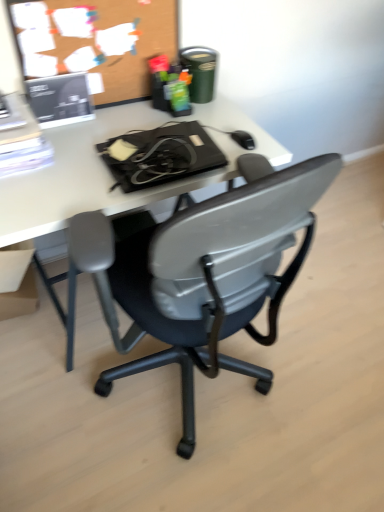
This screenshot has height=512, width=384. What do you see at coordinates (243, 139) in the screenshot?
I see `black plastic mouse at upper right` at bounding box center [243, 139].

What is the approximate width of white plastic desk at center?

white plastic desk at center is 63.67 centimeters wide.

What is the approximate height of white plastic desk at center?

It is 29.07 inches.

Where is `black plastic chair at center`? This screenshot has width=384, height=512. black plastic chair at center is located at coordinates (203, 273).

Consider the image. Between black plastic chair at center and white plastic desk at center, which one has less height?

black plastic chair at center is shorter.

Considering the positions of points (307, 172) and (176, 185), is point (307, 172) closer to camera compared to point (176, 185)?

Yes.

Find the location of a particular element. Image resolution: width=384 pixels, height=512 pixels. chair located below the white plastic desk at center (from the image's perspective) is located at coordinates (203, 273).

Between black plastic chair at center and white plastic desk at center, which one has smaller width?

Thinner between the two is white plastic desk at center.

Between wooden bulletin board at upper left and white plastic desk at center, which one has smaller size?

wooden bulletin board at upper left.

Can you tell me how much wooden bulletin board at upper left and white plastic desk at center differ in facing direction?

The angle between the facing direction of wooden bulletin board at upper left and the facing direction of white plastic desk at center is 0.436 degrees.

Is point (137, 61) in front of point (244, 126)?

No.

Considering the relative sizes of wooden bulletin board at upper left and white plastic desk at center in the image provided, is wooden bulletin board at upper left taller than white plastic desk at center?

No, wooden bulletin board at upper left is not taller than white plastic desk at center.

Looking at this image, in the image, is matte cardboard box at lower left on the left side or the right side of black plastic chair at center?

Clearly, matte cardboard box at lower left is on the left of black plastic chair at center in the image.

Is matte cardboard box at lower left placed right next to black plastic chair at center?

There is a gap between matte cardboard box at lower left and black plastic chair at center.

There is a black plastic chair at center. Where is `box above it (from a real-world perspective)`? This screenshot has width=384, height=512. box above it (from a real-world perspective) is located at coordinates (17, 284).

From a real-world perspective, which is physically above, matte cardboard box at lower left or black plastic chair at center?

From a 3D spatial view, matte cardboard box at lower left is above.

Is black plastic chair at center at the back of white plastic desk at center?

→ white plastic desk at center does not have its back to black plastic chair at center.

Which object is closer to the camera, white plastic desk at center or black plastic chair at center?

black plastic chair at center.

Is white plastic desk at center far away from black plastic chair at center?

No, white plastic desk at center is not far from black plastic chair at center.

From the image's perspective, does white plastic desk at center appear lower than black plastic chair at center?

No, from the image's perspective, white plastic desk at center is not below black plastic chair at center.

Which is more to the right, black plastic mouse at upper right or wooden bulletin board at upper left?

From the viewer's perspective, black plastic mouse at upper right appears more on the right side.

Does black plastic mouse at upper right turn towards wooden bulletin board at upper left?

No, black plastic mouse at upper right is not aimed at wooden bulletin board at upper left.

What's the angular difference between black plastic mouse at upper right and wooden bulletin board at upper left's facing directions?

The facing directions of black plastic mouse at upper right and wooden bulletin board at upper left are 5.13 degrees apart.

What are the coordinates of `mouse located below the wooden bulletin board at upper left (from the image's perspective)` in the screenshot? It's located at (243, 139).

Is black plastic chair at center outside of black plastic mouse at upper right?

That's correct, black plastic chair at center is outside of black plastic mouse at upper right.

At what (x,y) coordinates should I click in order to perform the action: click on chair lying on the right of black plastic mouse at upper right. Please return your answer as a coordinate pair (x, y). The image size is (384, 512). Looking at the image, I should click on (203, 273).

Considering the relative sizes of black plastic chair at center and black plastic mouse at upper right in the image provided, is black plastic chair at center bigger than black plastic mouse at upper right?

Correct, black plastic chair at center is larger in size than black plastic mouse at upper right.

From the image's perspective, is black plastic chair at center located above black plastic mouse at upper right?

Incorrect, from the image's perspective, black plastic chair at center is lower than black plastic mouse at upper right.

Measure the distance from wooden bulletin board at upper left to black plastic chair at center.

wooden bulletin board at upper left and black plastic chair at center are 81.68 centimeters apart from each other.

How different are the orientations of wooden bulletin board at upper left and black plastic chair at center in degrees?

There is a 90.5-degree angle between the facing directions of wooden bulletin board at upper left and black plastic chair at center.

Which of these two, wooden bulletin board at upper left or black plastic chair at center, is wider?

black plastic chair at center is wider.

Between point (109, 85) and point (194, 343), which one is positioned behind?

Point (109, 85)

Identify the location of desk that is above the black plastic chair at center (from the image's perspective). This screenshot has height=512, width=384. (89, 177).

Where is `desk directly beneath the wooden bulletin board at upper left (from a real-world perspective)`? Image resolution: width=384 pixels, height=512 pixels. desk directly beneath the wooden bulletin board at upper left (from a real-world perspective) is located at coordinates (89, 177).

Considering their positions, is black plastic mouse at upper right positioned further to matte cardboard box at lower left than black plastic chair at center?

black plastic mouse at upper right.

Which object lies further to the anchor point wooden bulletin board at upper left, matte cardboard box at lower left or white plastic desk at center?

matte cardboard box at lower left.

When comparing their distances from black plastic mouse at upper right, does black plastic chair at center or white plastic desk at center seem closer?

Among the two, white plastic desk at center is located nearer to black plastic mouse at upper right.

Considering their positions, is black plastic mouse at upper right positioned closer to wooden bulletin board at upper left than white plastic desk at center?

Among the two, white plastic desk at center is located nearer to wooden bulletin board at upper left.

From the image, which object appears to be farther from black plastic chair at center, matte cardboard box at lower left or wooden bulletin board at upper left?

Based on the image, wooden bulletin board at upper left appears to be further to black plastic chair at center.

Considering their positions, is black plastic chair at center positioned closer to wooden bulletin board at upper left than matte cardboard box at lower left?

black plastic chair at center.

Based on their spatial positions, is white plastic desk at center or black plastic chair at center closer to black plastic mouse at upper right?

Based on the image, white plastic desk at center appears to be nearer to black plastic mouse at upper right.

When comparing their distances from matte cardboard box at lower left, does wooden bulletin board at upper left or white plastic desk at center seem further?

Based on the image, wooden bulletin board at upper left appears to be further to matte cardboard box at lower left.

Where is `mouse between matte cardboard box at lower left and black plastic chair at center`? This screenshot has width=384, height=512. mouse between matte cardboard box at lower left and black plastic chair at center is located at coordinates (243, 139).

Locate an element on the screen. The height and width of the screenshot is (512, 384). desk between wooden bulletin board at upper left and matte cardboard box at lower left vertically is located at coordinates tap(89, 177).

Where is `mouse between wooden bulletin board at upper left and white plastic desk at center in the up-down direction`? mouse between wooden bulletin board at upper left and white plastic desk at center in the up-down direction is located at coordinates (243, 139).

Image resolution: width=384 pixels, height=512 pixels. In order to click on desk between wooden bulletin board at upper left and black plastic chair at center in the up-down direction in this screenshot , I will do `click(89, 177)`.